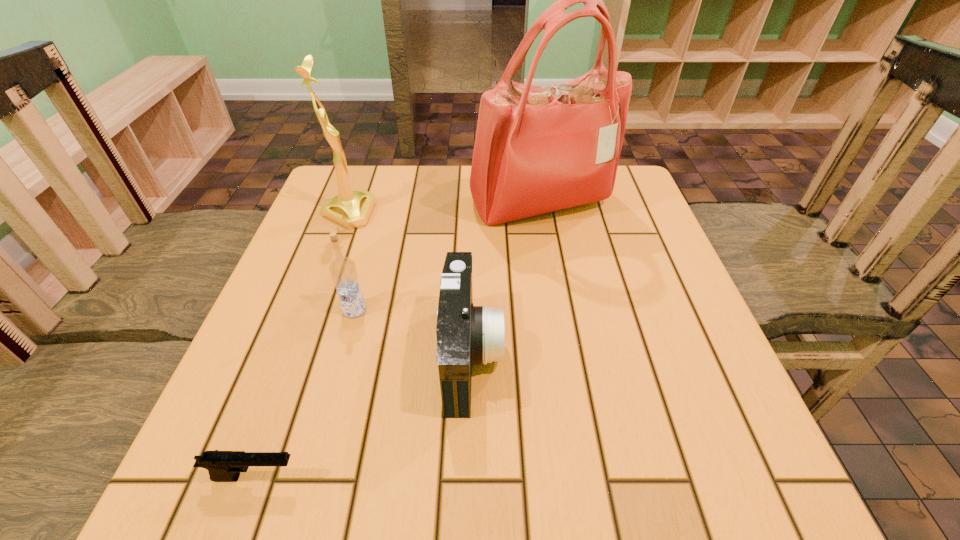
This screenshot has height=540, width=960. In order to click on handbag in this screenshot , I will do `click(538, 149)`.

Where is `the fourth shortest object`? Image resolution: width=960 pixels, height=540 pixels. the fourth shortest object is located at coordinates (351, 209).

The height and width of the screenshot is (540, 960). Identify the location of vodka. (343, 271).

What are the coordinates of `the fourth tallest object` in the screenshot? It's located at (466, 334).

Locate an element on the screen. The width and height of the screenshot is (960, 540). the nearest object is located at coordinates (223, 466).

Where is `the shortest object`? The width and height of the screenshot is (960, 540). the shortest object is located at coordinates (223, 466).

You are a GUI agent. You are given a task and a screenshot of the screen. Output one action in this format:
    pyautogui.click(x=<x>, y=<y>)
    Task: Click on the vacant space located 0.330m on the front-facing side of the handbag
    
    Given the screenshot: What is the action you would take?
    click(565, 356)

You are a GUI agent. You are given a task and a screenshot of the screen. Output one action in this format:
    pyautogui.click(x=<x>, y=<y>)
    Task: Click on the vacant region located on the front-facing side of the award
    The height and width of the screenshot is (540, 960).
    Given the screenshot: What is the action you would take?
    pyautogui.click(x=496, y=213)

The width and height of the screenshot is (960, 540). Identify the location of vacant space located 0.230m on the front of the vodka. (320, 435).

Locate an element on the screen. The image size is (960, 540). blank space located on the lens of the second shortest object is located at coordinates (564, 355).